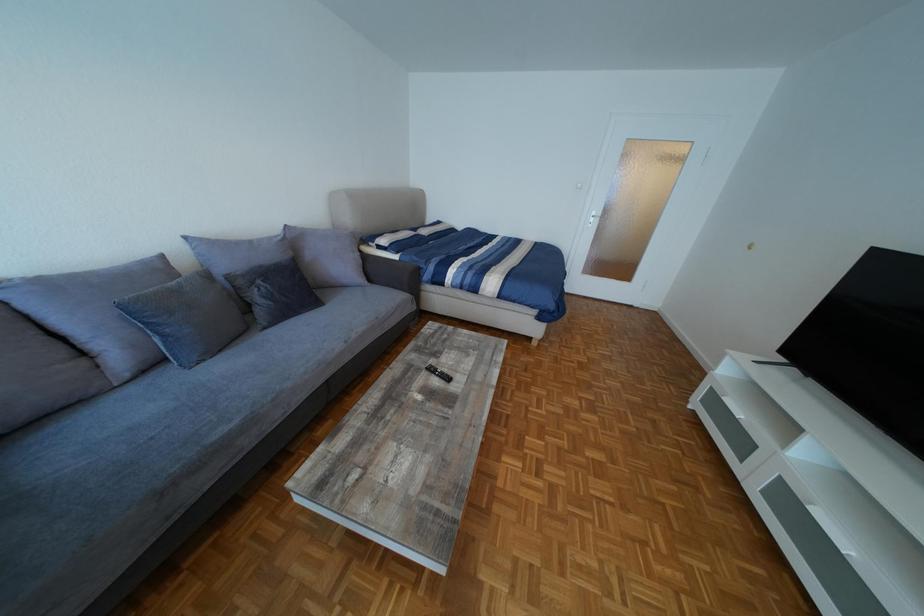
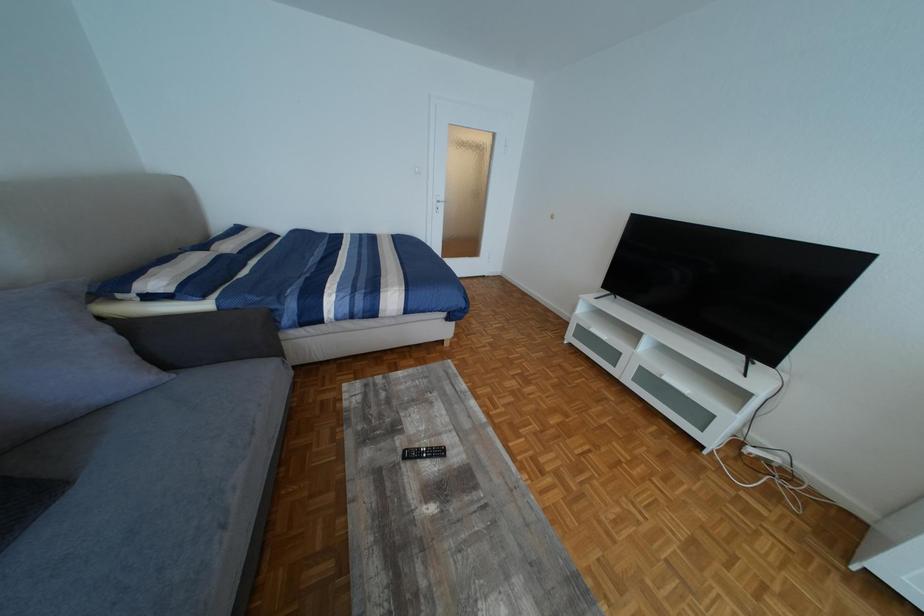
Question: The camera is either moving clockwise (left) or counter-clockwise (right) around the object. The first image is from the beginning of the video and the second image is from the end. Is the camera moving left or right when shooting the video?

Choices:
 (A) Left
 (B) Right

Answer: (A)